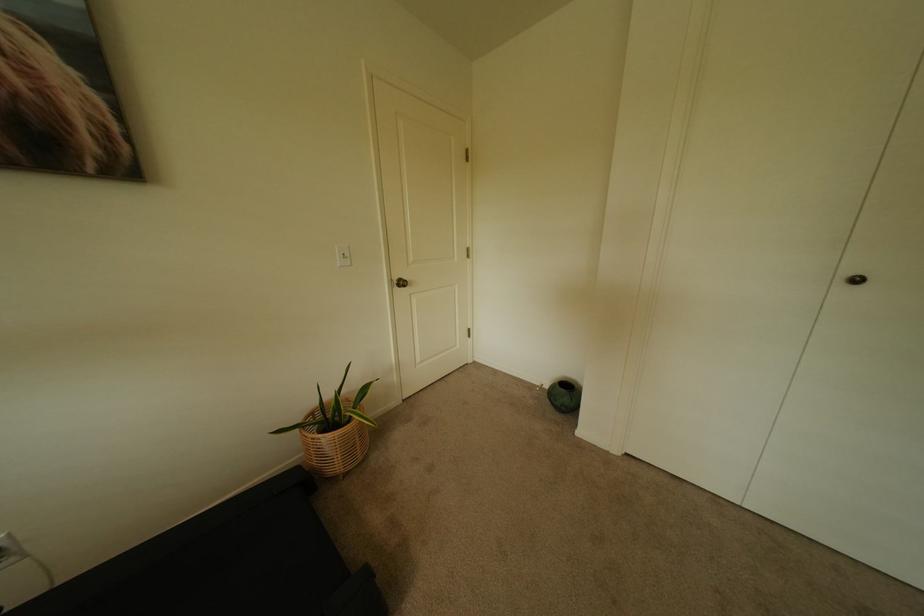
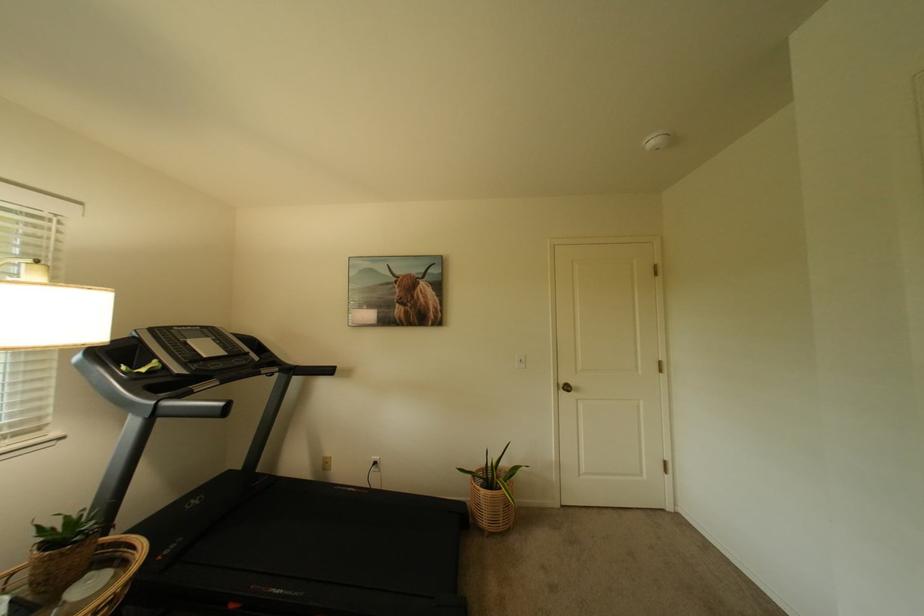
Where in the second image is the point corresponding to point 347,458 from the first image?

(495, 515)